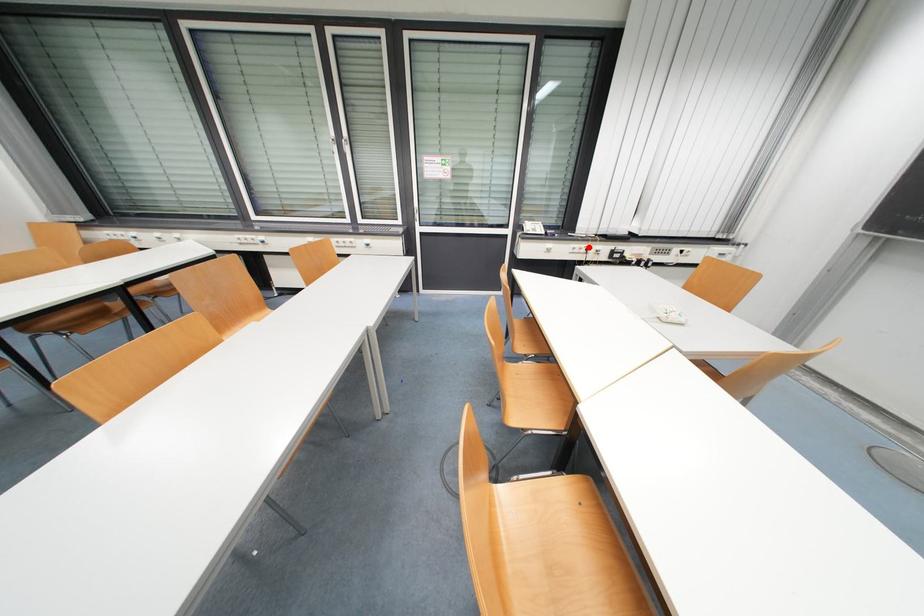
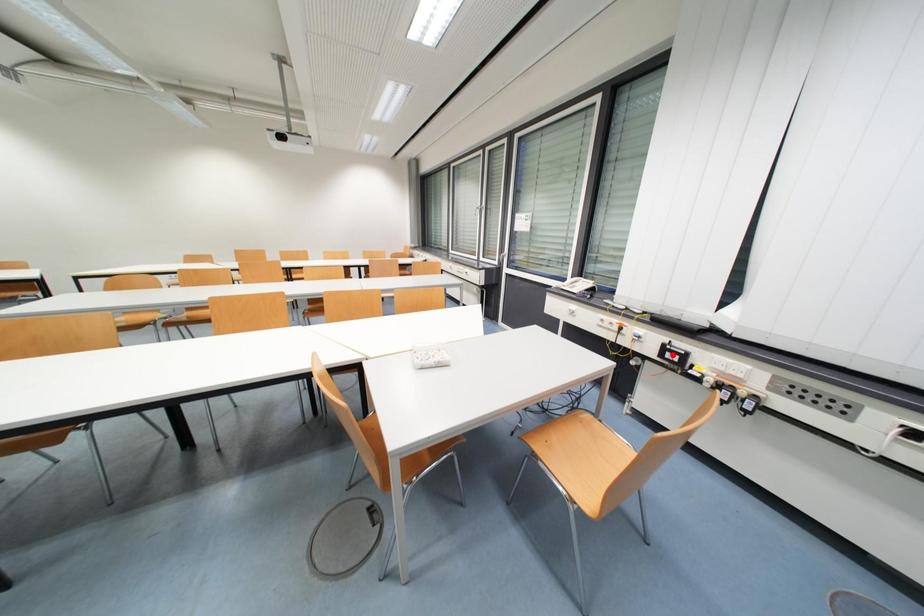
I am providing you with two images of the same scene from different viewpoints. A red point is marked on the first image and another point is marked on the second image. Is the red point in image1 aligned with the point shown in image2?

No